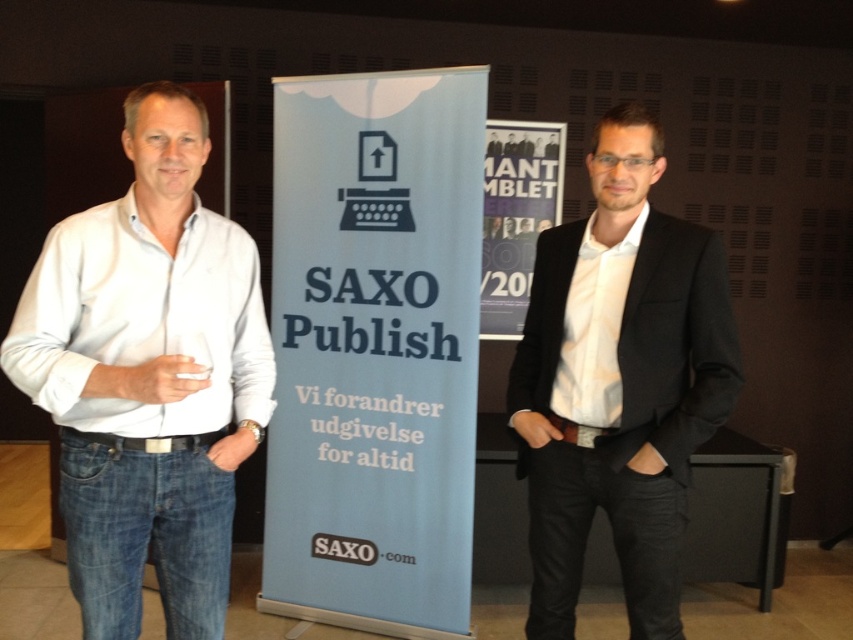
Question: Does blue paper banner at center have a lesser width compared to white cotton shirt at left?

Choices:
 (A) no
 (B) yes

Answer: (A)

Question: Which of these objects is positioned farthest from the white cotton shirt at left?

Choices:
 (A) black smooth blazer at center
 (B) blue paper banner at center

Answer: (B)

Question: Which point appears closest to the camera in this image?

Choices:
 (A) (422, 460)
 (B) (157, 337)

Answer: (B)

Question: Does blue paper banner at center have a lesser width compared to black smooth blazer at center?

Choices:
 (A) no
 (B) yes

Answer: (A)

Question: Which object is farther from the camera taking this photo?

Choices:
 (A) white cotton shirt at left
 (B) black smooth blazer at center

Answer: (B)

Question: Is white cotton shirt at left positioned in front of black smooth blazer at center?

Choices:
 (A) no
 (B) yes

Answer: (B)